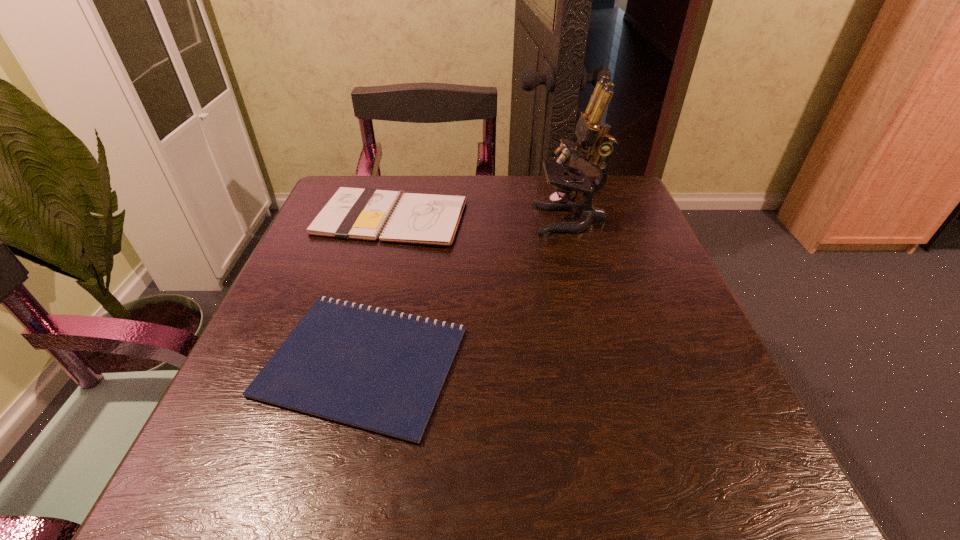
You are a GUI agent. You are given a task and a screenshot of the screen. Output one action in this format:
    pyautogui.click(x=<x>, y=<y>)
    Task: Click on the tallest object
    
    Given the screenshot: What is the action you would take?
    pyautogui.click(x=593, y=139)

Locate an element on the screen. the rightmost object is located at coordinates (593, 139).

At what (x,y) coordinates should I click in order to perform the action: click on the farther notepad. Please return your answer as a coordinate pair (x, y). Image resolution: width=960 pixels, height=540 pixels. Looking at the image, I should click on (367, 214).

Where is `the taller notepad`? the taller notepad is located at coordinates (367, 214).

Locate an element on the screen. The width and height of the screenshot is (960, 540). the nearer notepad is located at coordinates (382, 371).

Find the location of a particular element. The height and width of the screenshot is (540, 960). the shorter notepad is located at coordinates (382, 371).

You are a GUI agent. You are given a task and a screenshot of the screen. Output one action in this format:
    pyautogui.click(x=<x>, y=<y>)
    Task: Click on the vacant space located at the eyepieces of the tallest object
    
    Given the screenshot: What is the action you would take?
    pyautogui.click(x=442, y=220)

This screenshot has width=960, height=540. In order to click on vacant area located 0.120m at the eyepieces of the tallest object in this screenshot , I will do `click(484, 220)`.

The image size is (960, 540). In order to click on free space located 0.310m at the eyepieces of the tallest object in this screenshot , I will do `click(403, 220)`.

I want to click on vacant point located on the front of the second tallest object, so click(x=377, y=270).